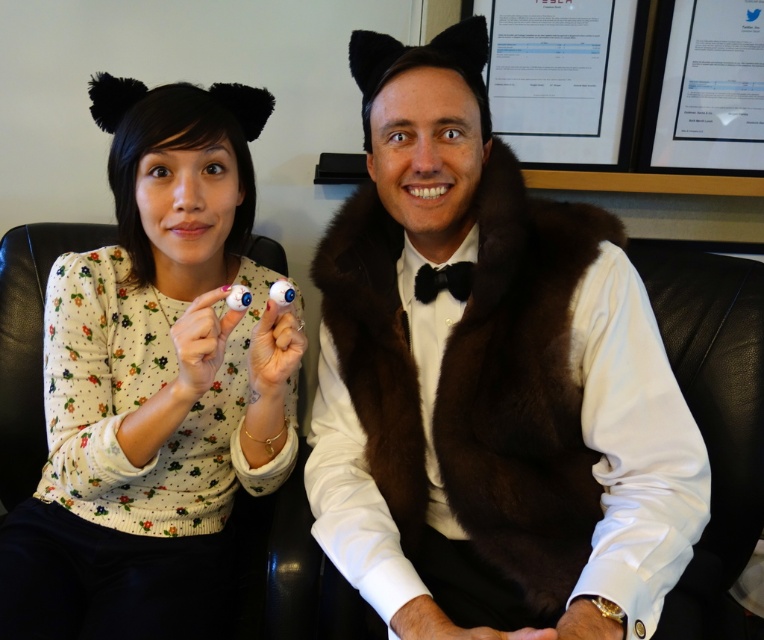
Question: Can you confirm if brown fur vest at center is positioned below white floral sweater at left?

Choices:
 (A) no
 (B) yes

Answer: (A)

Question: Which point appears farthest from the camera in this image?

Choices:
 (A) (468, 273)
 (B) (374, 76)

Answer: (A)

Question: Which point is farther to the camera?

Choices:
 (A) (180, 113)
 (B) (371, 202)
 (C) (455, 285)

Answer: (B)

Question: Is brown fur vest at center wider than black satin bow tie at center?

Choices:
 (A) no
 (B) yes

Answer: (B)

Question: Which point is closer to the camera taking this photo?

Choices:
 (A) (387, 346)
 (B) (146, 342)

Answer: (A)

Question: Can you confirm if brown fur vest at center is thinner than white floral sweater at left?

Choices:
 (A) no
 (B) yes

Answer: (A)